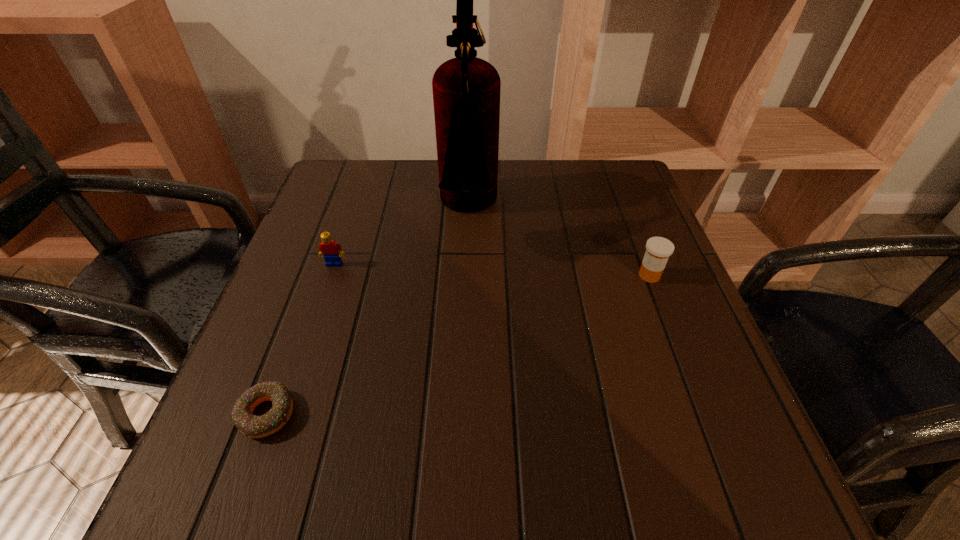
Where is `free area in between the rightmost object and the fire extinguisher`? free area in between the rightmost object and the fire extinguisher is located at coordinates (559, 242).

The width and height of the screenshot is (960, 540). Identify the location of free space that is in between the rightmost object and the Lego. (492, 270).

Where is `the third closest object relative to the medicine`? The width and height of the screenshot is (960, 540). the third closest object relative to the medicine is located at coordinates (253, 426).

Where is `object that is the second closest one to the Lego`? object that is the second closest one to the Lego is located at coordinates (253, 426).